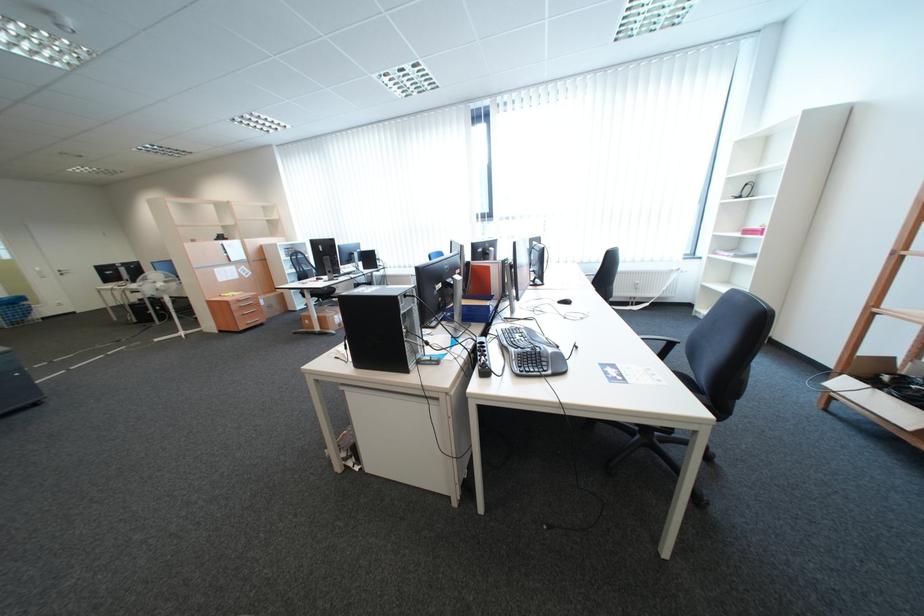
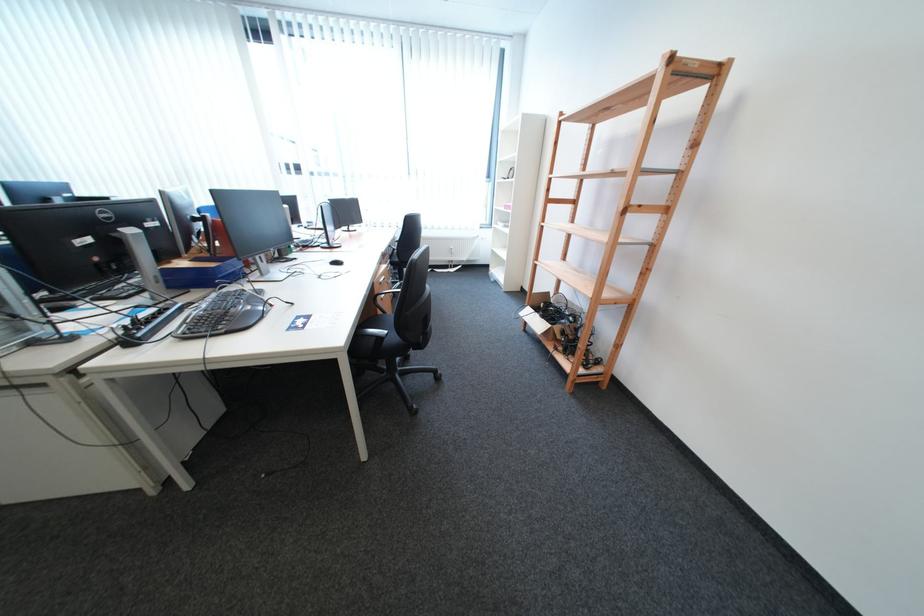
The point at (471, 318) is marked in the first image. Where is the corresponding point in the second image?

(169, 283)